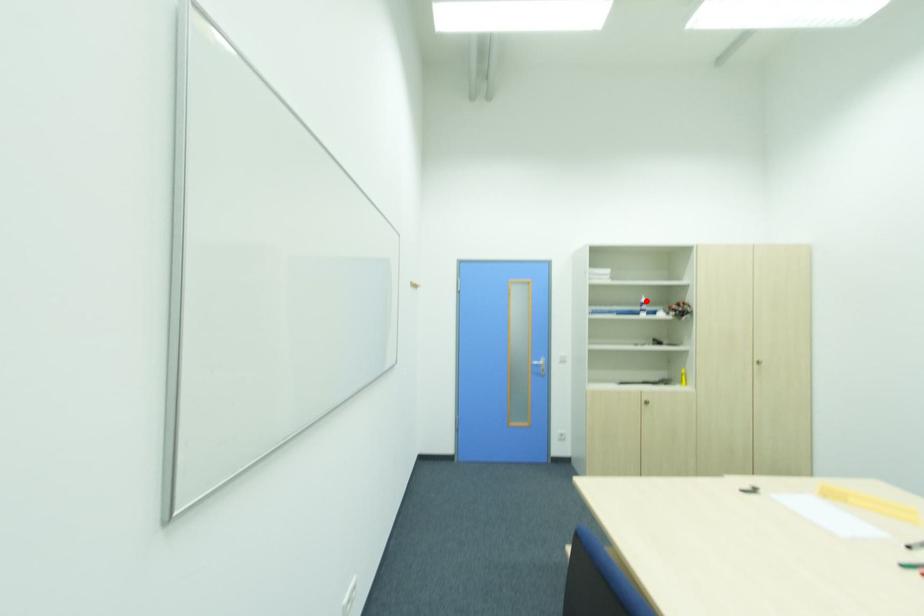
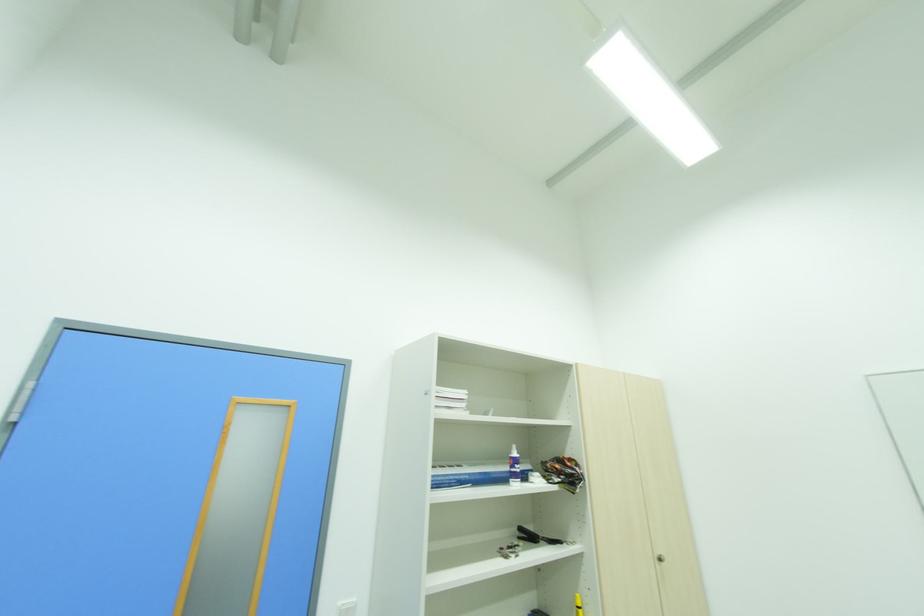
Where in the second image is the point corresponding to the highlighted location from the first image?

(517, 455)